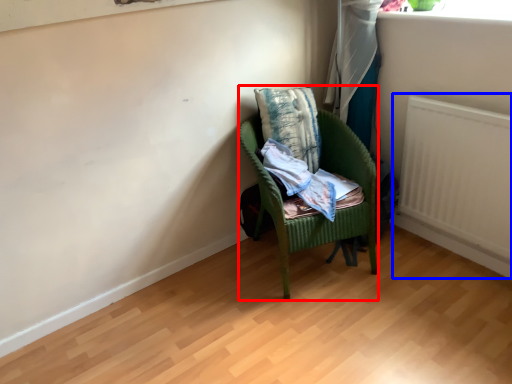
Question: Which object appears farthest to the camera in this image, chair (highlighted by a red box) or radiator (highlighted by a blue box)?

Choices:
 (A) chair
 (B) radiator

Answer: (A)